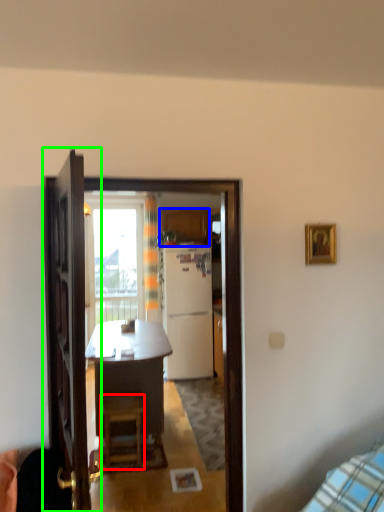
Question: Estimate the real-world distances between objects in this image. Which object is farther from stool (highlighted by a red box), cabinetry (highlighted by a blue box) or door (highlighted by a green box)?

Choices:
 (A) cabinetry
 (B) door

Answer: (A)